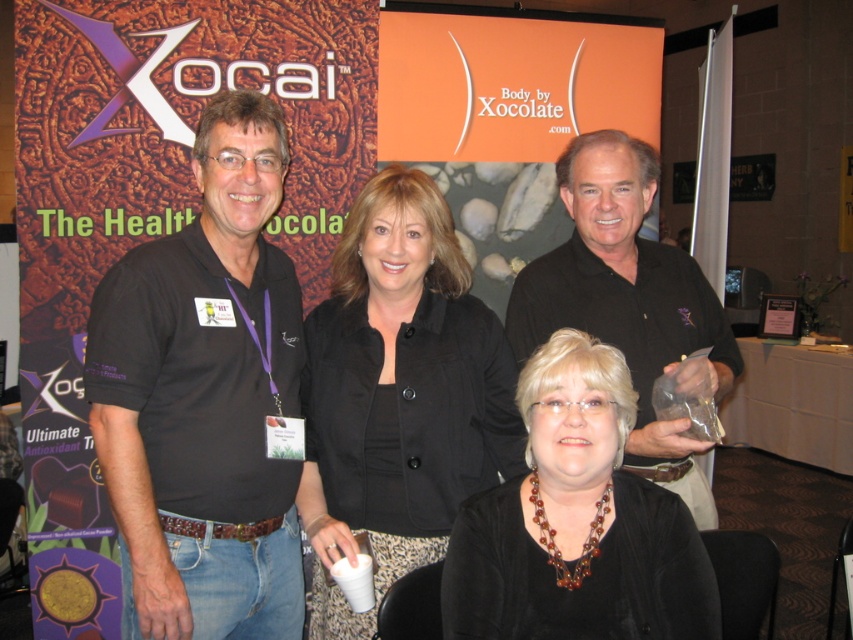
You are a photographer at the event and need to ensure that both the black shirt at left and the black matte shirt at center are visible in the photo. Based on their positions, which one is closer to the camera?

The black shirt at left is in front of the black matte shirt at center, so it is closer to the camera.

Looking at this image, you are a photographer at the Xocai event. You need to arrange two people wearing different shirts for a photo. The shirts are the black velvet blouse at center and the black matte shirt at center. According to the current setup, which shirt is on the left?

The black velvet blouse at center is positioned on the left side of the black matte shirt at center, so the black velvet blouse at center is on the left.

You are a photographer at the event and need to adjust the lighting so that both the black shirt at left and the black matte shirt at center are equally visible. Since the backdrop has a textured design resembling ancient stone carvings, which might cause reflections, which shirt should you focus the light on first to ensure proper exposure?

The black shirt at left is located below black matte shirt at center. Since the black matte shirt at center is higher up, it might be in a different light zone. Focus the light on the black matte shirt at center first to balance exposure with the lower positioned black shirt at left.